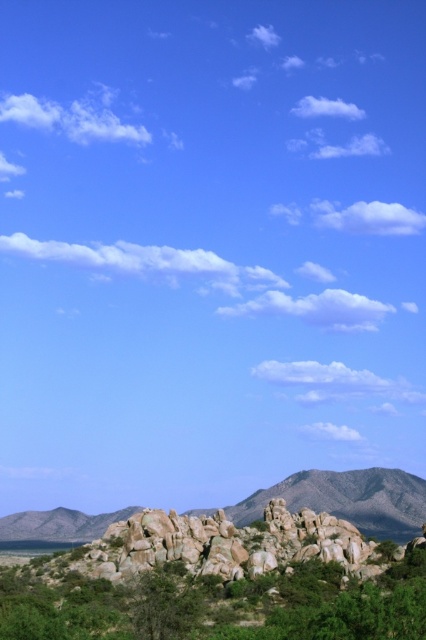
Question: Is green leafy shrubs at lower center wider than rocky gray mountain at lower right?

Choices:
 (A) yes
 (B) no

Answer: (B)

Question: Which point is farther from the camera taking this photo?

Choices:
 (A) (184, 609)
 (B) (391, 499)

Answer: (B)

Question: Does green leafy shrubs at lower center come behind rocky gray mountain at lower right?

Choices:
 (A) no
 (B) yes

Answer: (A)

Question: Among these points, which one is farthest from the camera?

Choices:
 (A) (3, 602)
 (B) (385, 504)

Answer: (B)

Question: Is green leafy shrubs at lower center positioned before rocky gray mountain at lower right?

Choices:
 (A) no
 (B) yes

Answer: (B)